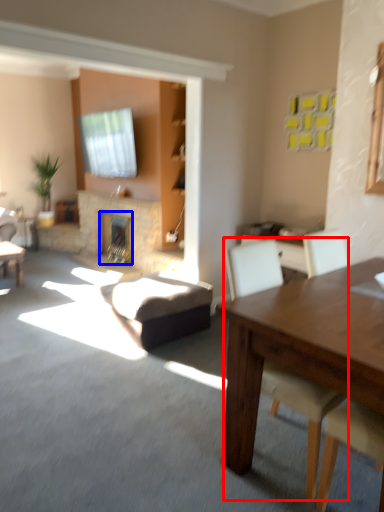
Question: Among these objects, which one is farthest to the camera, chair (highlighted by a red box) or fireplace (highlighted by a blue box)?

Choices:
 (A) chair
 (B) fireplace

Answer: (B)